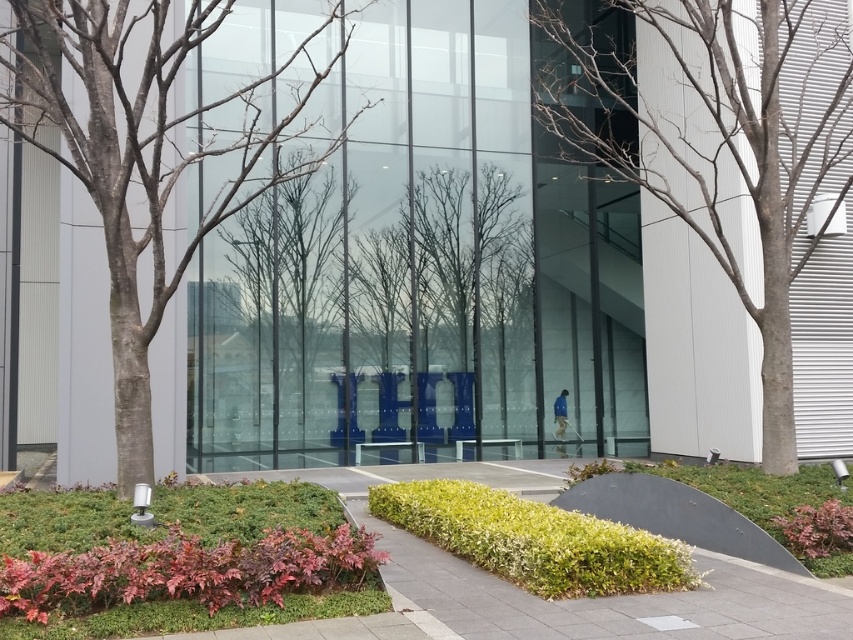
You are a landscape architect designing a new garden. You want to place a small statue that requires a base area of 0.5 square meters. Which object from the scene, the bare wood tree at left or the green grass at lower center, would provide enough space for the statue?

The green grass at lower center is larger than the bare wood tree at left, so it can accommodate the statue requiring 0.5 square meters.

You are standing at the entrance of the building and want to reach the point marked as point (334, 220). The pathway is 3 feet wide. Can you walk straight to the point without stepping off the pathway?

The point (334, 220) is 44.00 feet away from the viewer. Since the pathway is 3 feet wide, you can walk straight to the point (334, 220) without stepping off the pathway as long as you stay within the 3 feet width.